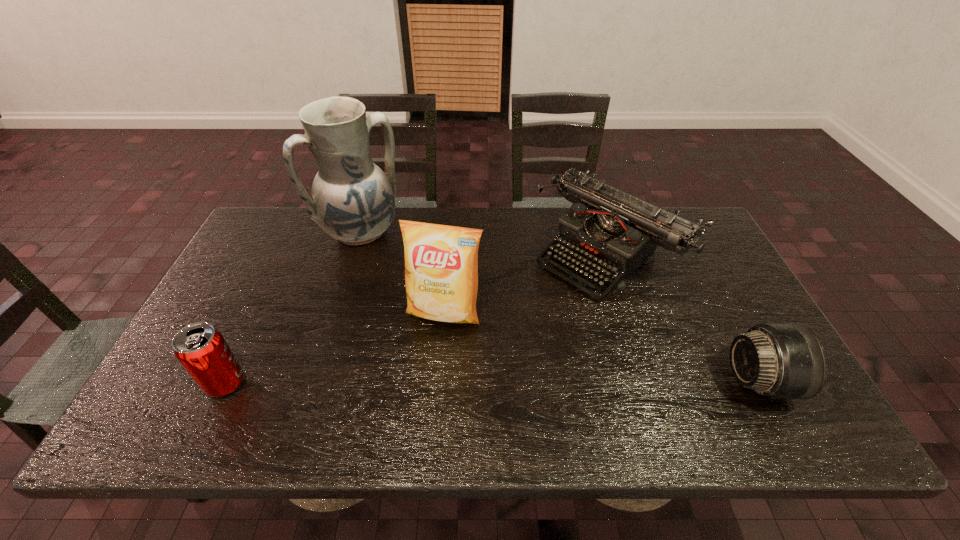
The image size is (960, 540). Find the location of `free space located on the front-facing side of the second object from left to right`. free space located on the front-facing side of the second object from left to right is located at coordinates (425, 305).

At what (x,y) coordinates should I click in order to perform the action: click on blank area located on the keyboard of the typewriter. Please return your answer as a coordinate pair (x, y). Looking at the image, I should click on (494, 352).

Locate an element on the screen. The image size is (960, 540). vacant space located 0.170m on the keyboard of the typewriter is located at coordinates (527, 323).

You are a GUI agent. You are given a task and a screenshot of the screen. Output one action in this format:
    pyautogui.click(x=<x>, y=<y>)
    Task: Click on the vacant space located on the keyboard of the typewriter
    This screenshot has width=960, height=540.
    Given the screenshot: What is the action you would take?
    pyautogui.click(x=499, y=348)

Identify the location of vacant space located on the front-facing side of the crisp (potato chip). (429, 348).

Identify the location of vacant space located on the front-facing side of the crisp (potato chip). (422, 368).

Where is `pitcher located in the far edge section of the desktop`? pitcher located in the far edge section of the desktop is located at coordinates (353, 200).

Locate an element on the screen. The image size is (960, 540). typewriter positioned at the far edge is located at coordinates (614, 232).

Where is `soda can positioned at the near edge`? This screenshot has width=960, height=540. soda can positioned at the near edge is located at coordinates (201, 349).

Locate an element on the screen. telephoto lens at the near edge is located at coordinates (776, 360).